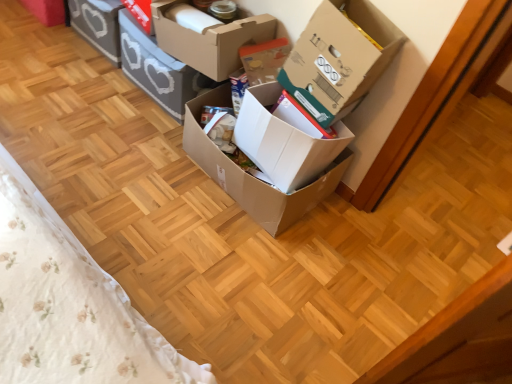
Where is `vacant space in front of cardboard box at center, the 5th box positioned from the right`? The image size is (512, 384). vacant space in front of cardboard box at center, the 5th box positioned from the right is located at coordinates (127, 134).